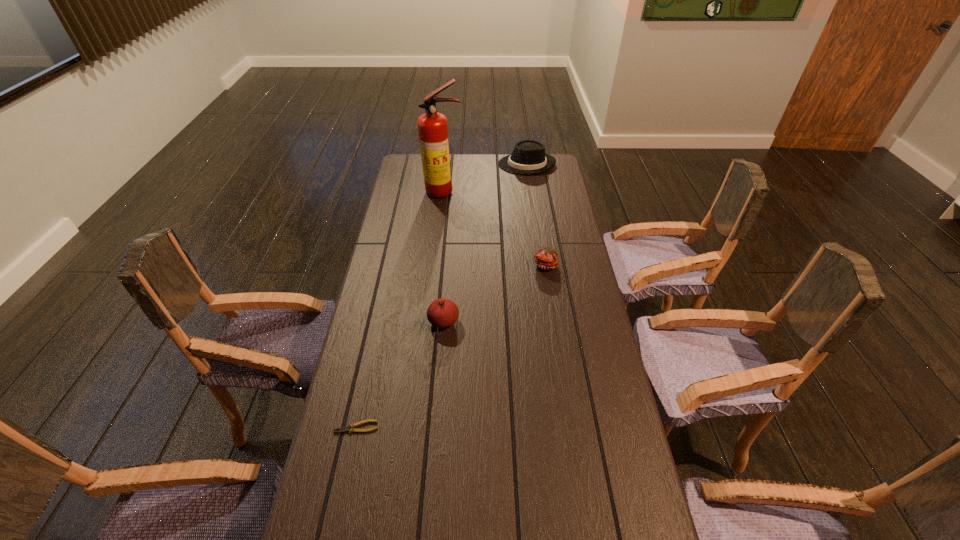
Where is `fire extinguisher`? fire extinguisher is located at coordinates (432, 126).

Image resolution: width=960 pixels, height=540 pixels. I want to click on the fourth nearest object, so click(x=432, y=126).

Find the location of `fedora`. fedora is located at coordinates (528, 157).

I want to click on the taller tomato, so [x=441, y=313].

In order to click on the left tomato in this screenshot , I will do tap(441, 313).

Locate an element on the screen. The width and height of the screenshot is (960, 540). the third nearest object is located at coordinates tap(545, 258).

You are a GUI agent. You are given a task and a screenshot of the screen. Output one action in this format:
    pyautogui.click(x=<x>, y=<y>)
    Task: Click on the fourth tallest object
    
    Given the screenshot: What is the action you would take?
    pyautogui.click(x=545, y=258)

Locate an element on the screen. pliers is located at coordinates (345, 428).

This screenshot has width=960, height=540. Identify the location of the leftmost object. (345, 428).

Where is `blank space located on the front-facing side of the fire extinguisher`? The image size is (960, 540). blank space located on the front-facing side of the fire extinguisher is located at coordinates (442, 208).